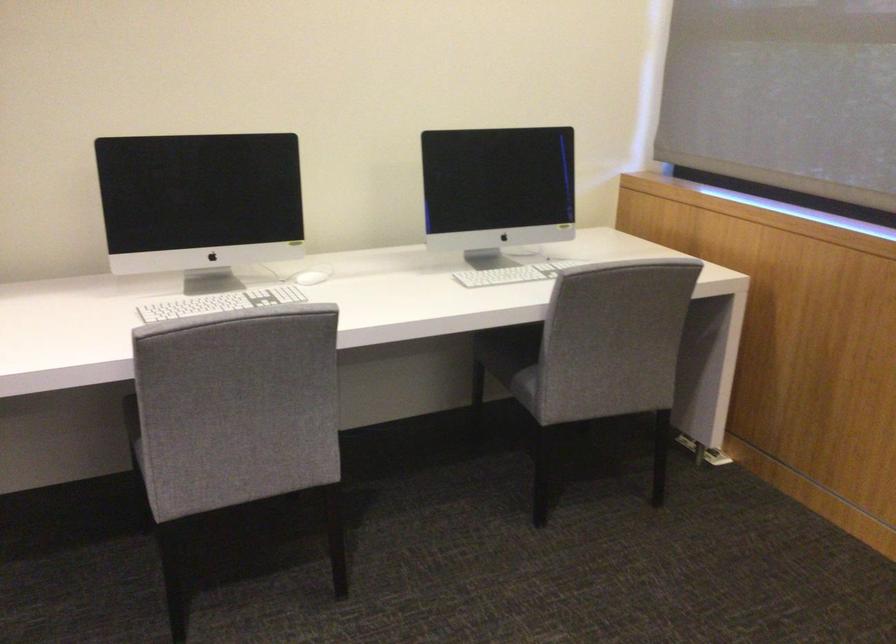
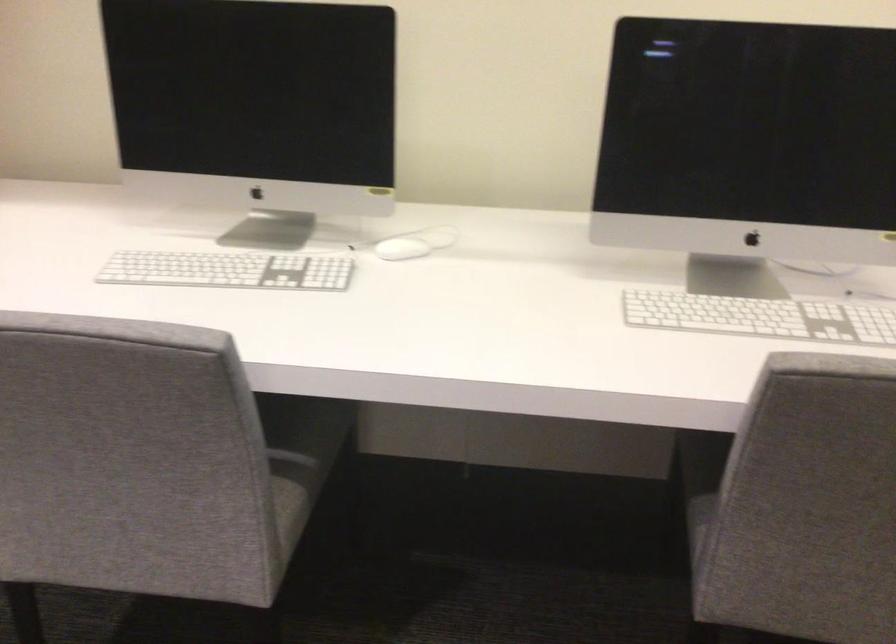
Locate, in the second image, the point that corresponds to [212,305] in the first image.

(228, 270)